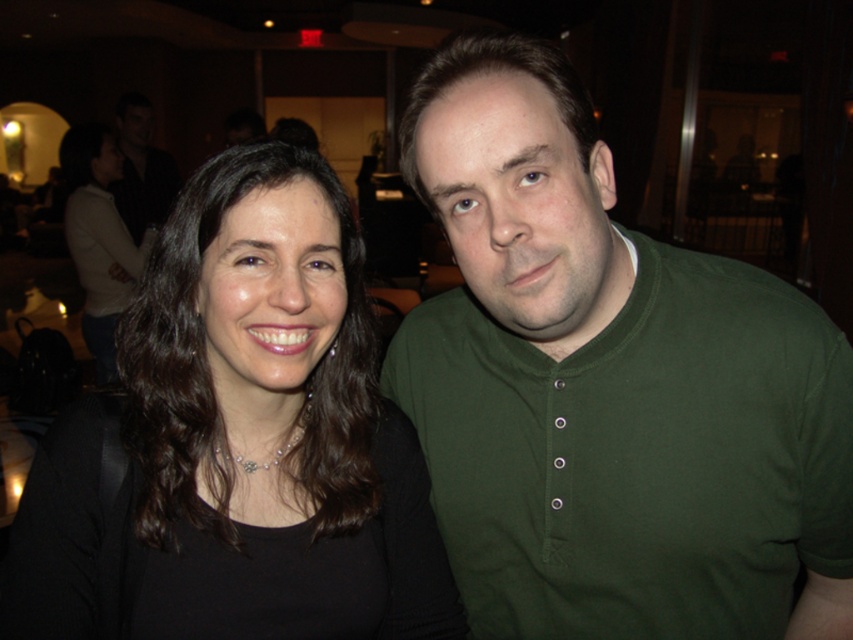
Question: Which point appears closest to the camera in this image?

Choices:
 (A) (103, 621)
 (B) (843, 529)
 (C) (137, 154)

Answer: (A)

Question: Which object is positioned farthest from the matte black shirt at upper left?

Choices:
 (A) black matte shirt at center
 (B) green cotton shirt at center

Answer: (B)

Question: Can you confirm if black matte shirt at center is bigger than matte black shirt at upper left?

Choices:
 (A) yes
 (B) no

Answer: (B)

Question: Which point appears farthest from the camera in this image?

Choices:
 (A) [155, 193]
 (B) [225, 611]

Answer: (A)

Question: Can you confirm if green cotton shirt at center is positioned below black matte shirt at center?

Choices:
 (A) yes
 (B) no

Answer: (B)

Question: Is black matte shirt at center above matte black shirt at upper left?

Choices:
 (A) yes
 (B) no

Answer: (B)